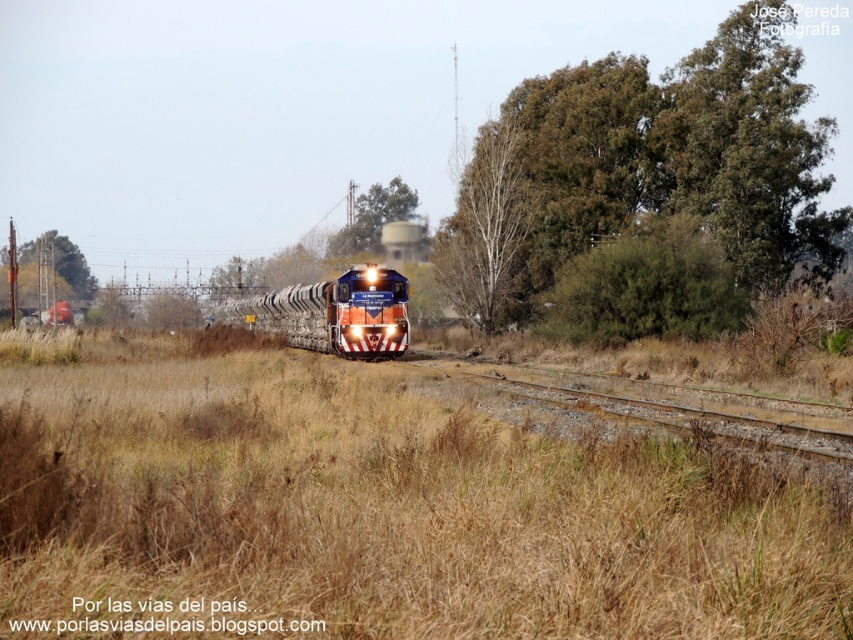
Consider the image. You are standing at the point with coordinates point (70, 272) and want to look towards the direction of the train. Is the point point (300, 316) blocking your view?

Point (300, 316) is in front of point (70, 272), so yes, the point point (300, 316) is blocking your view.